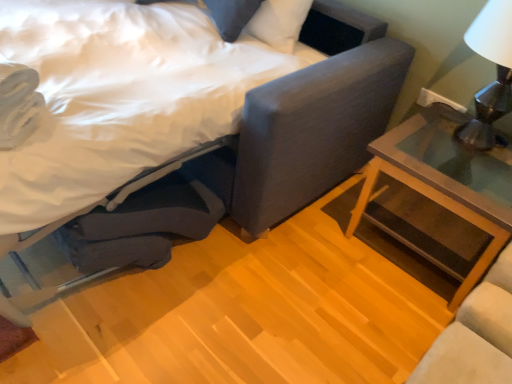
Identify the location of matte gray bed at center. Image resolution: width=512 pixels, height=384 pixels. (310, 120).

In order to face matte gray bed at center, should I rotate leftwards or rightwards?

Turn left by 17.567 degrees to look at matte gray bed at center.

This screenshot has width=512, height=384. What do you see at coordinates (310, 120) in the screenshot? I see `matte gray bed at center` at bounding box center [310, 120].

The width and height of the screenshot is (512, 384). What are the coordinates of `clear glass nightstand at right` in the screenshot? It's located at (446, 180).

This screenshot has width=512, height=384. What do you see at coordinates (446, 180) in the screenshot? I see `clear glass nightstand at right` at bounding box center [446, 180].

Identify the location of matte gray bed at center. The image size is (512, 384). (310, 120).

Does matte gray bed at center appear on the left side of clear glass nightstand at right?

Yes.

Which object is further away from the camera taking this photo, matte gray bed at center or clear glass nightstand at right?

clear glass nightstand at right is behind.

Which is behind, point (385, 90) or point (504, 151)?

Point (385, 90)

From the image's perspective, does matte gray bed at center appear higher than clear glass nightstand at right?

Correct, matte gray bed at center appears higher than clear glass nightstand at right in the image.

From a real-world perspective, is matte gray bed at center positioned above or below clear glass nightstand at right?

Clearly, from a real-world perspective, matte gray bed at center is above clear glass nightstand at right.

Does matte gray bed at center have a greater width compared to clear glass nightstand at right?

Yes.

Considering the sizes of objects matte gray bed at center and clear glass nightstand at right in the image provided, who is shorter, matte gray bed at center or clear glass nightstand at right?

With less height is clear glass nightstand at right.

Who is bigger, matte gray bed at center or clear glass nightstand at right?

matte gray bed at center is bigger.

Is matte gray bed at center not inside clear glass nightstand at right?

Yes, matte gray bed at center is outside of clear glass nightstand at right.

Would you say matte gray bed at center is a long distance from clear glass nightstand at right?

No, matte gray bed at center is in close proximity to clear glass nightstand at right.

Is matte gray bed at center oriented away from clear glass nightstand at right?

matte gray bed at center is not turned away from clear glass nightstand at right.

Where is `bed on the left of clear glass nightstand at right`? bed on the left of clear glass nightstand at right is located at coordinates (310, 120).

Considering the positions of objects clear glass nightstand at right and matte gray bed at center in the image provided, who is more to the left, clear glass nightstand at right or matte gray bed at center?

matte gray bed at center.

Is clear glass nightstand at right further to the viewer compared to matte gray bed at center?

Yes, it is.

Which is nearer, (506, 194) or (332, 76)?

Point (506, 194) appears to be farther away from the viewer than point (332, 76).

From the image's perspective, is clear glass nightstand at right positioned above or below matte gray bed at center?

clear glass nightstand at right is below matte gray bed at center.

From a real-world perspective, is clear glass nightstand at right positioned under matte gray bed at center based on gravity?

Yes.

Does clear glass nightstand at right have a lesser width compared to matte gray bed at center?

Indeed, clear glass nightstand at right has a lesser width compared to matte gray bed at center.

Between clear glass nightstand at right and matte gray bed at center, which one has more height?

Standing taller between the two is matte gray bed at center.

Who is smaller, clear glass nightstand at right or matte gray bed at center?

clear glass nightstand at right.

Is clear glass nightstand at right not inside matte gray bed at center?

clear glass nightstand at right is positioned outside matte gray bed at center.

Is clear glass nightstand at right not near matte gray bed at center?

No, clear glass nightstand at right is not far away from matte gray bed at center.

Is clear glass nightstand at right oriented away from matte gray bed at center?

No, clear glass nightstand at right's orientation is not away from matte gray bed at center.

How many degrees apart are the facing directions of clear glass nightstand at right and matte gray bed at center?

The facing directions of clear glass nightstand at right and matte gray bed at center are 1.03 degrees apart.

Locate an element on the screen. The image size is (512, 384). nightstand that is on the right side of matte gray bed at center is located at coordinates (446, 180).

At what (x,y) coordinates should I click in order to perform the action: click on nightstand on the right of the matte gray bed at center. Please return your answer as a coordinate pair (x, y). Looking at the image, I should click on (446, 180).

You are a GUI agent. You are given a task and a screenshot of the screen. Output one action in this format:
    pyautogui.click(x=<x>, y=<y>)
    Task: Click on the nightstand that is below the matte gray bed at center (from the image's perspective)
    
    Given the screenshot: What is the action you would take?
    pyautogui.click(x=446, y=180)